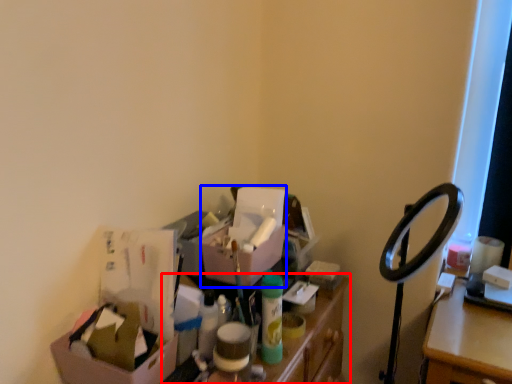
Question: Which object appears closest to the camera in this image, furniture (highlighted by a red box) or box (highlighted by a blue box)?

Choices:
 (A) furniture
 (B) box

Answer: (A)